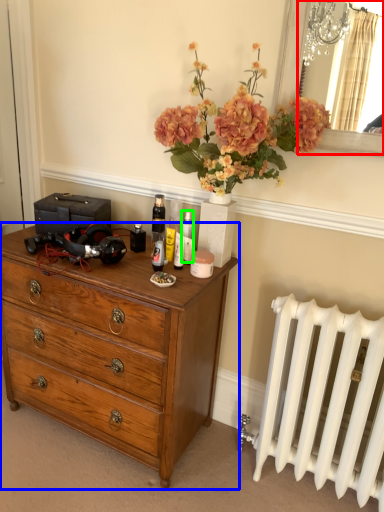
Question: Which is farther away from mirror (highlighted by a red box)? chest of drawers (highlighted by a blue box) or toiletry (highlighted by a green box)?

Choices:
 (A) chest of drawers
 (B) toiletry

Answer: (A)